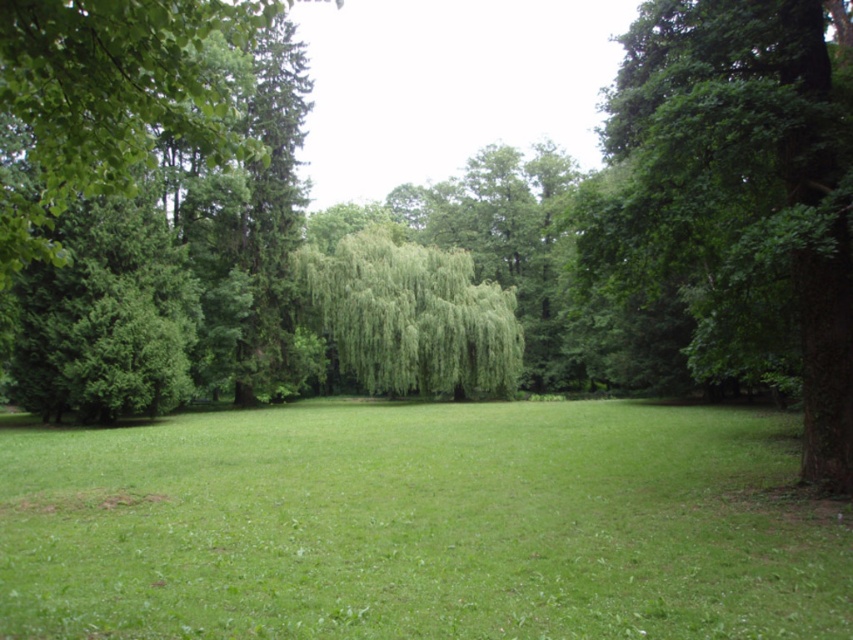
Which is more to the right, green grass at center or green leafy willow at center?

green grass at center

Does green grass at center have a lesser width compared to green leafy willow at center?

Incorrect, green grass at center's width is not less than green leafy willow at center's.

Which is behind, point (405, 481) or point (485, 340)?

Point (485, 340)

Identify the location of green grass at center. (421, 524).

Can you confirm if green grass at center is wider than green leafy tree at right?

Correct, the width of green grass at center exceeds that of green leafy tree at right.

Is green grass at center positioned at the back of green leafy tree at right?

That is False.

Between point (763, 592) and point (828, 364), which one is positioned in front?

Point (763, 592) is in front.

You are a GUI agent. You are given a task and a screenshot of the screen. Output one action in this format:
    pyautogui.click(x=<x>, y=<y>)
    Task: Click on the green grass at center
    The image size is (853, 640).
    Given the screenshot: What is the action you would take?
    pyautogui.click(x=421, y=524)

Between green leafy tree at right and green leafy willow at center, which one has less height?

With less height is green leafy willow at center.

Does green leafy tree at right lie in front of green leafy willow at center?

Yes, green leafy tree at right is in front of green leafy willow at center.

Is point (692, 148) more distant than point (352, 289)?

No, (692, 148) is closer to viewer.

Image resolution: width=853 pixels, height=640 pixels. What are the coordinates of `green leafy tree at right` in the screenshot? It's located at (740, 195).